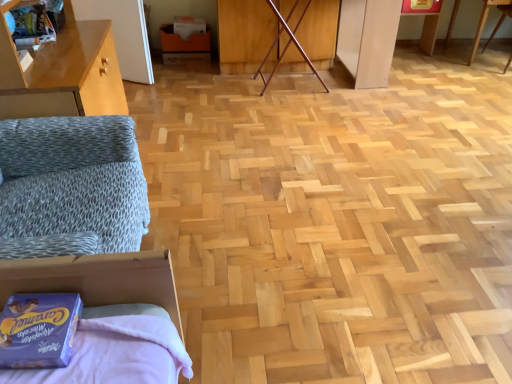
Identify the location of free location in front of matte cardboard box at center. (182, 68).